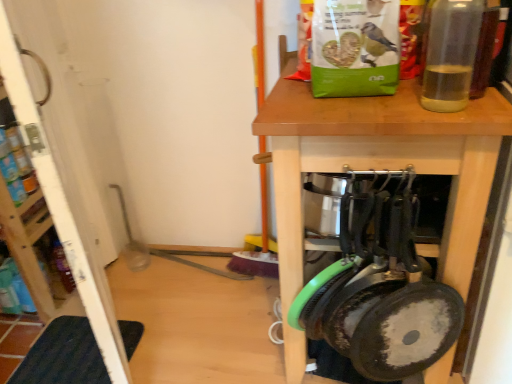
Locate an element on the screen. Image resolution: width=512 pixels, height=384 pixels. free space underneath dark blue rubber mat at lower left (from a real-world perspective) is located at coordinates (79, 358).